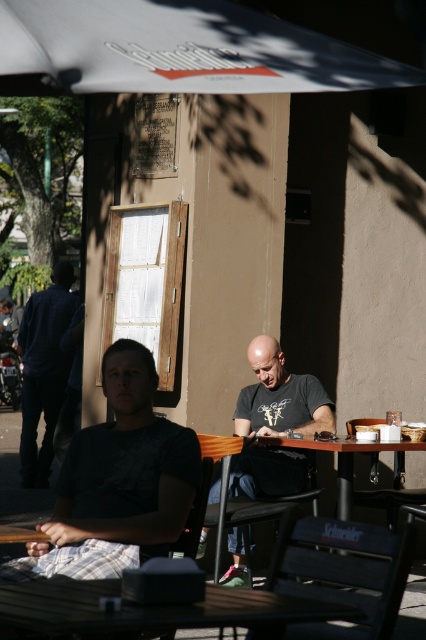
Which is above, white fabric canopy at upper center or dark gray t-shirt at center?

white fabric canopy at upper center is above.

Is point (14, 3) behind point (118, 417)?

No, (14, 3) is closer to viewer.

Is point (2, 6) closer to camera compared to point (62, 541)?

Yes.

At what (x,y) coordinates should I click in order to perform the action: click on white fabric canopy at upper center. Please return your answer as a coordinate pair (x, y). This screenshot has width=426, height=640. Looking at the image, I should click on (176, 51).

Does wooden table at center have a greater width compared to wooden picnic table at center?

Indeed, wooden table at center has a greater width compared to wooden picnic table at center.

Between point (94, 598) and point (344, 518), which one is positioned behind?

The point (344, 518) is more distant.

Does point (36, 598) lie in front of point (344, 456)?

That is True.

Image resolution: width=426 pixels, height=640 pixels. Find the location of `wooden table at center`. wooden table at center is located at coordinates (149, 609).

Who is positioned more to the left, dark gray t-shirt at center or black matte shirt at center?

dark gray t-shirt at center

Between dark gray t-shirt at center and black matte shirt at center, which one is positioned lower?

black matte shirt at center is lower down.

Does point (109, 560) come farther from viewer compared to point (241, 576)?

No, it is in front of (241, 576).

At what (x,y) coordinates should I click in order to perform the action: click on dark gray t-shirt at center. Please return your answer as a coordinate pair (x, y). Image resolution: width=426 pixels, height=640 pixels. Looking at the image, I should click on (117, 481).